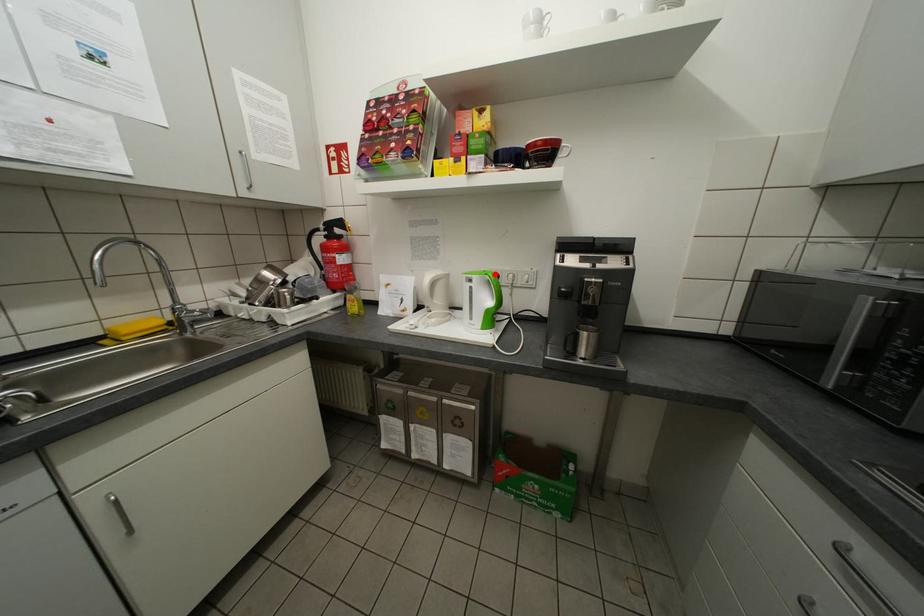
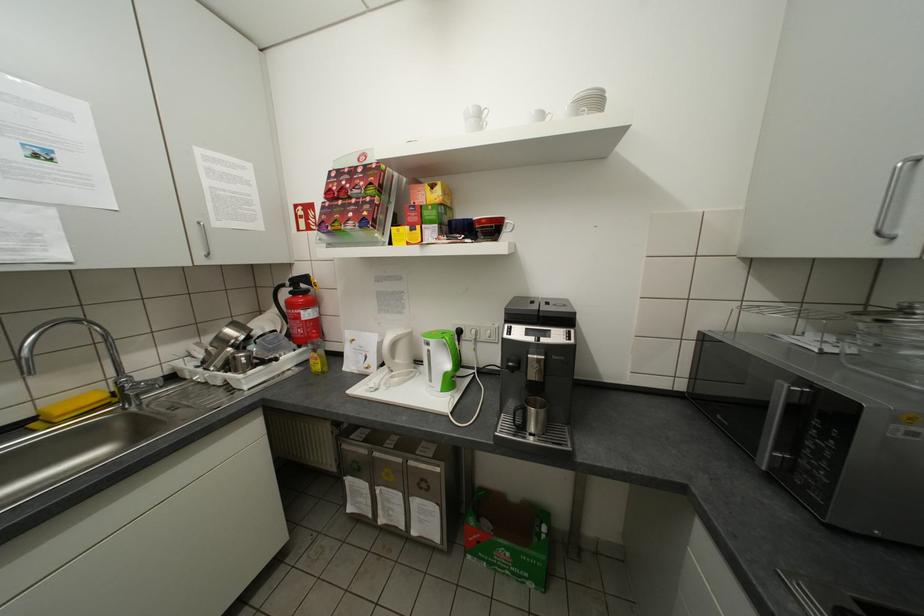
In the second image, find the point that corresponds to the highlighted location in the first image.

(452, 338)